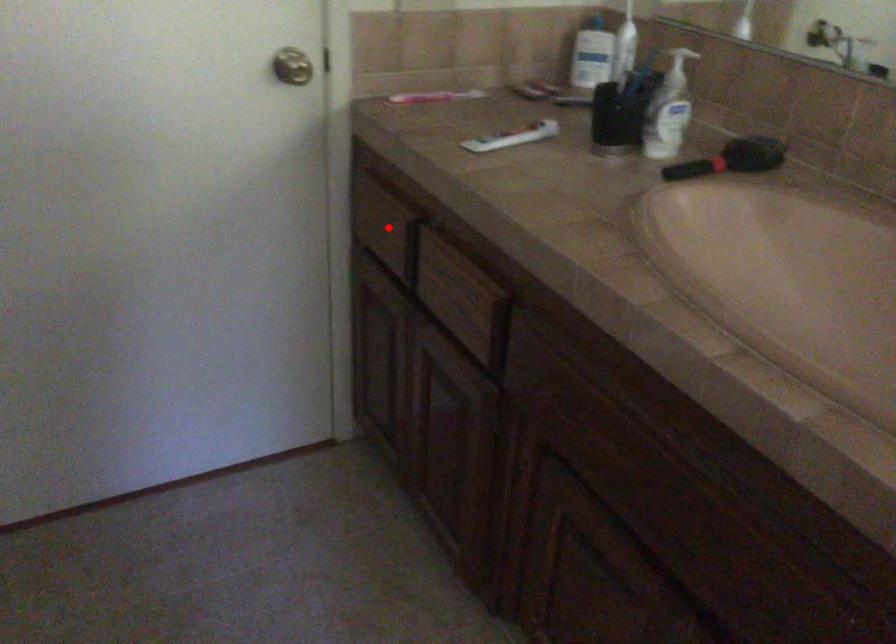
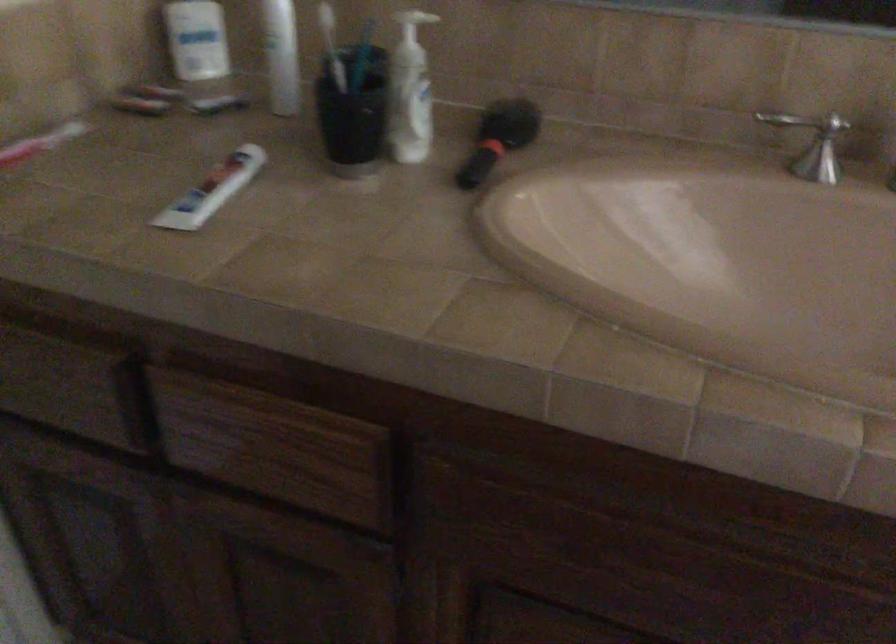
The point at the highlighted location is marked in the first image. Where is the corresponding point in the second image?

(74, 388)